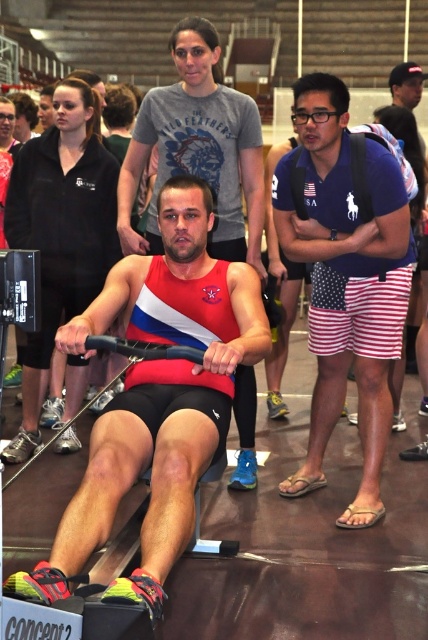
Question: Does red matte tank top at center appear under blue cotton polo shirt at center?

Choices:
 (A) no
 (B) yes

Answer: (B)

Question: Can you confirm if matte red tank top at center is positioned to the left of red fabric tank top at center?

Choices:
 (A) no
 (B) yes

Answer: (B)

Question: Does blue cotton polo shirt at center appear on the right side of red fabric tank top at center?

Choices:
 (A) no
 (B) yes

Answer: (B)

Question: Which point is farther from the camera taking this photo?

Choices:
 (A) (174, 88)
 (B) (100, 490)
 (C) (53, 179)
 (D) (329, 124)

Answer: (C)

Question: Which object appears closest to the camera in this image?

Choices:
 (A) red fabric tank top at center
 (B) matte red tank top at center

Answer: (A)

Question: Which point is closer to the camera?

Choices:
 (A) (366, 328)
 (B) (204, 312)
 (C) (253, 172)
 (D) (86, 147)

Answer: (B)